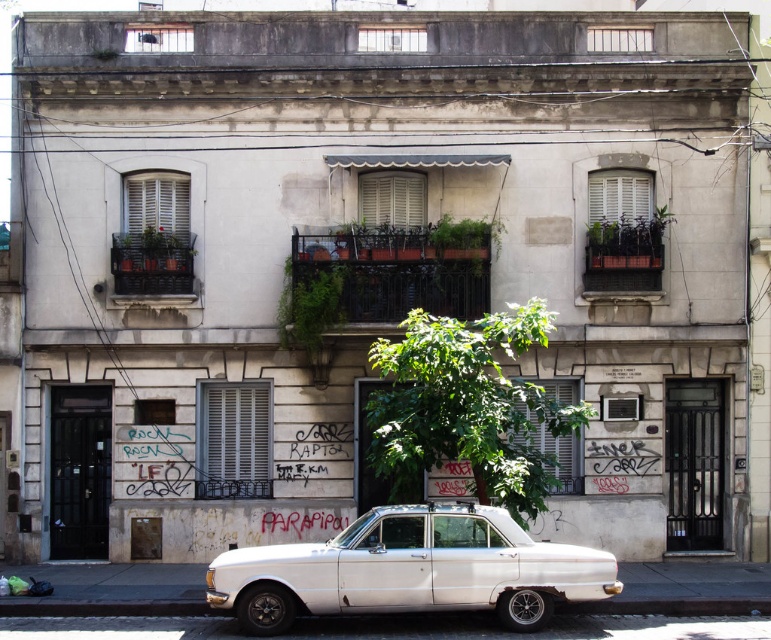
In the scene shown: Does white matte car at lower center appear under green leafy tree at center?

Yes, white matte car at lower center is below green leafy tree at center.

Locate an element on the screen. The image size is (771, 640). white matte car at lower center is located at coordinates (409, 570).

This screenshot has width=771, height=640. Identify the location of white matte car at lower center. pyautogui.click(x=409, y=570).